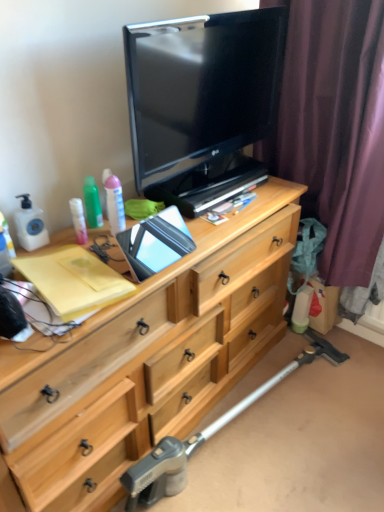
Question: Is the depth of metallic silver crutch at lower center greater than that of matte black tv at upper center?

Choices:
 (A) no
 (B) yes

Answer: (B)

Question: From the image's perspective, is metallic silver crutch at lower center under matte black tv at upper center?

Choices:
 (A) no
 (B) yes

Answer: (B)

Question: Would you say metallic silver crutch at lower center is a long distance from matte black tv at upper center?

Choices:
 (A) no
 (B) yes

Answer: (B)

Question: From a real-world perspective, is metallic silver crutch at lower center under matte black tv at upper center?

Choices:
 (A) no
 (B) yes

Answer: (B)

Question: Are metallic silver crutch at lower center and matte black tv at upper center beside each other?

Choices:
 (A) yes
 (B) no

Answer: (B)

Question: Is purple fabric curtain at right in front of or behind metallic silver crutch at lower center in the image?

Choices:
 (A) behind
 (B) front

Answer: (A)

Question: From a real-world perspective, is purple fabric curtain at right above or below metallic silver crutch at lower center?

Choices:
 (A) below
 (B) above

Answer: (B)

Question: Considering the positions of purple fabric curtain at right and metallic silver crutch at lower center in the image, is purple fabric curtain at right taller or shorter than metallic silver crutch at lower center?

Choices:
 (A) short
 (B) tall

Answer: (B)

Question: Is point [x=301, y=105] positioned closer to the camera than point [x=127, y=483]?

Choices:
 (A) farther
 (B) closer

Answer: (A)

Question: From their relative heights in the image, would you say purple fabric curtain at right is taller or shorter than green matte spray can at upper left?

Choices:
 (A) short
 (B) tall

Answer: (B)

Question: In terms of size, does purple fabric curtain at right appear bigger or smaller than green matte spray can at upper left?

Choices:
 (A) big
 (B) small

Answer: (A)

Question: From the image's perspective, is purple fabric curtain at right positioned above or below green matte spray can at upper left?

Choices:
 (A) below
 (B) above

Answer: (B)

Question: From a real-world perspective, is purple fabric curtain at right positioned above or below green matte spray can at upper left?

Choices:
 (A) below
 (B) above

Answer: (B)

Question: Considering the positions of point (8, 382) and point (134, 500), is point (8, 382) closer or farther from the camera than point (134, 500)?

Choices:
 (A) farther
 (B) closer

Answer: (B)

Question: In terms of width, does light wood chest of drawers at center look wider or thinner when compared to metallic silver crutch at lower center?

Choices:
 (A) thin
 (B) wide

Answer: (B)